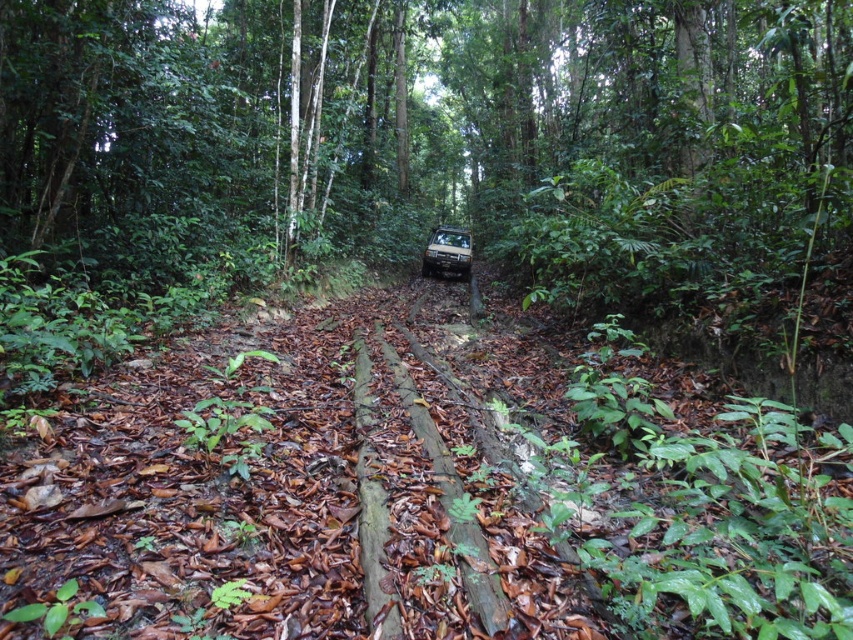
Between green leafy tree at center and brown wood at center, which one is positioned lower?

brown wood at center is below.

Is point (123, 113) positioned before point (54, 470)?

No, (123, 113) is further to viewer.

You are a GUI agent. You are given a task and a screenshot of the screen. Output one action in this format:
    pyautogui.click(x=<x>, y=<y>)
    Task: Click on the green leafy tree at center
    The image size is (853, 640).
    Given the screenshot: What is the action you would take?
    pyautogui.click(x=392, y=113)

Does brown wood at center have a greater width compared to metallic silver suv at center?

Yes.

Does brown wood at center have a greater height compared to metallic silver suv at center?

Incorrect, brown wood at center's height is not larger of metallic silver suv at center's.

Where is `brown wood at center`? brown wood at center is located at coordinates (310, 484).

Where is `brown wood at center`? The width and height of the screenshot is (853, 640). brown wood at center is located at coordinates (310, 484).

Can you confirm if green leafy tree at center is shorter than metallic silver suv at center?

No.

Image resolution: width=853 pixels, height=640 pixels. I want to click on green leafy tree at center, so click(x=392, y=113).

Is point (222, 36) more distant than point (459, 253)?

Yes, point (222, 36) is behind point (459, 253).

Where is `green leafy tree at center`? green leafy tree at center is located at coordinates (392, 113).